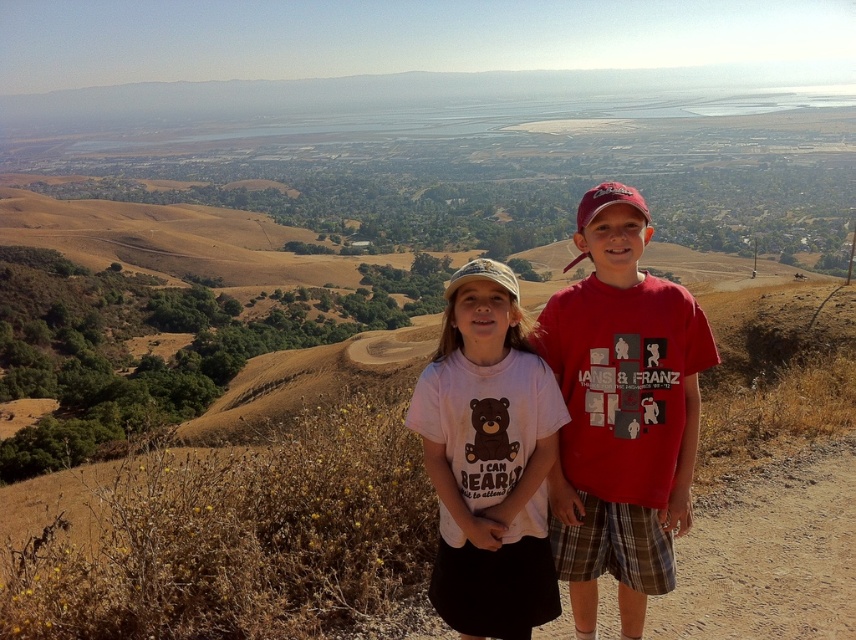
Does matte red t-shirt at center lie in front of white cotton shirt at center?

No, it is not.

Who is more distant from viewer, [697,436] or [488,372]?

Positioned behind is point [697,436].

Find the location of a particular element. matte red t-shirt at center is located at coordinates (621, 412).